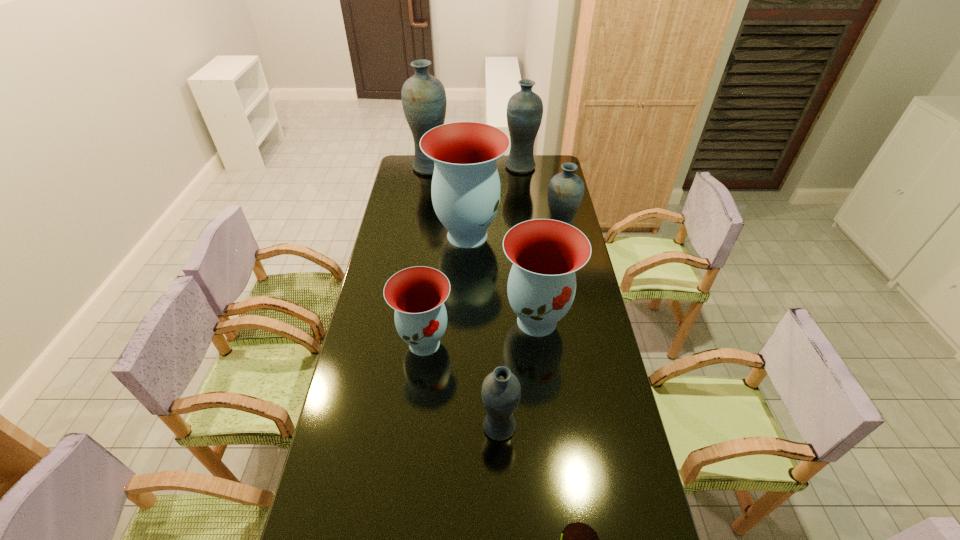
Locate an element on the screen. The image size is (960, 540). red vase that is the second closest to the smallest red vase is located at coordinates (466, 192).

Where is `free space that satisfies the following two spatial constraints: 1. on the front side of the second biggest blue vase; 2. on the left side of the second smallest blue vase`? free space that satisfies the following two spatial constraints: 1. on the front side of the second biggest blue vase; 2. on the left side of the second smallest blue vase is located at coordinates (530, 239).